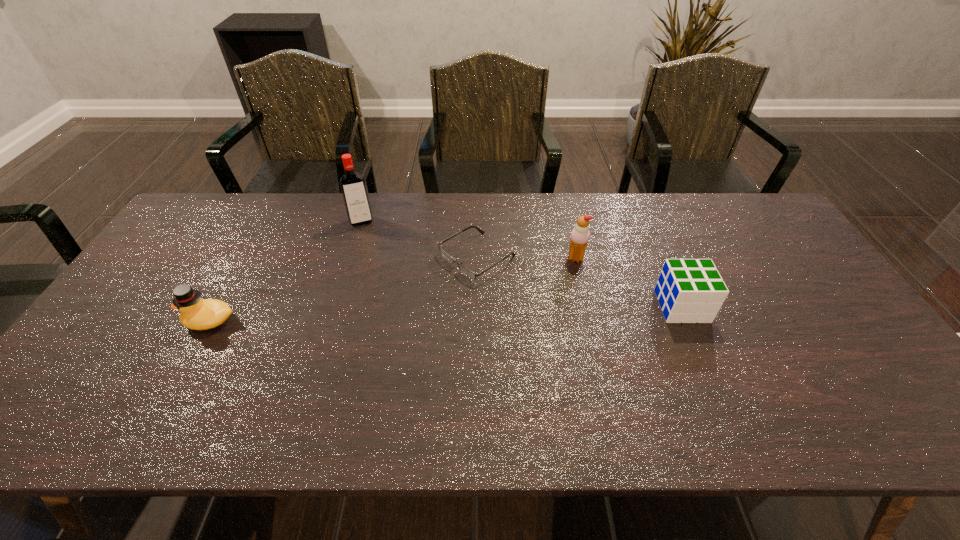
Find the location of a particular element. The height and width of the screenshot is (540, 960). free space located 0.280m on the red face of the cube is located at coordinates (808, 306).

The image size is (960, 540). I want to click on free space located 0.240m on the front-facing side of the third object from left to right, so click(x=376, y=319).

I want to click on vacant space located on the front-facing side of the third object from left to right, so click(x=360, y=329).

The image size is (960, 540). What are the coordinates of `free point located 0.070m on the front-facing side of the third object from left to right` in the screenshot? It's located at (428, 287).

This screenshot has width=960, height=540. Find the location of `vacant point located 0.140m at the front with a straw on the icecream`. vacant point located 0.140m at the front with a straw on the icecream is located at coordinates (534, 281).

Where is `free space located at the front with a straw on the icecream`? This screenshot has width=960, height=540. free space located at the front with a straw on the icecream is located at coordinates (549, 273).

Identify the location of free space located 0.170m at the front with a straw on the icecream. (525, 286).

I want to click on free spot located on the front and back of the farthest object, so click(x=370, y=247).

At what (x,y) coordinates should I click in order to perform the action: click on free space located on the front and back of the farthest object. Please return your answer as a coordinate pair (x, y). The width and height of the screenshot is (960, 540). Looking at the image, I should click on (374, 263).

What are the coordinates of `vacant space located on the front and back of the farthest object` in the screenshot? It's located at (372, 253).